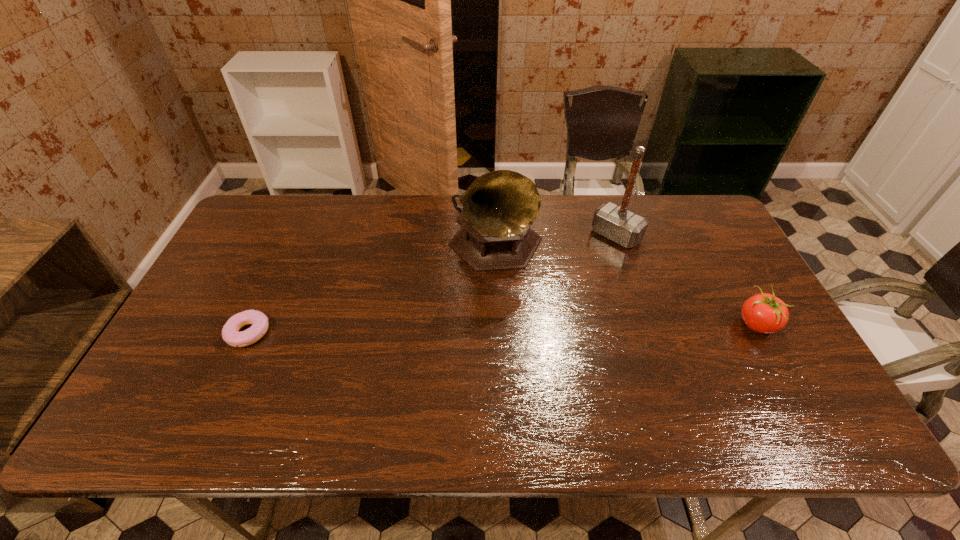
This screenshot has width=960, height=540. In the image, there is a desktop. What are the coordinates of `vacant space at the left edge` in the screenshot? It's located at (235, 253).

The image size is (960, 540). In the image, there is a desktop. Identify the location of free space at the right edge. (697, 262).

In the image, there is a desktop. At what (x,y) coordinates should I click in order to perform the action: click on free space at the far left corner. Please return your answer as a coordinate pair (x, y). The image size is (960, 540). Looking at the image, I should click on (262, 229).

Locate an element on the screen. free spot at the near right corner of the desktop is located at coordinates (768, 381).

Identify the location of vacant area that lies between the tomato and the shortest object. The height and width of the screenshot is (540, 960). (502, 329).

Where is `vacant space that is in between the hammer and the phonograph record`? The height and width of the screenshot is (540, 960). vacant space that is in between the hammer and the phonograph record is located at coordinates (556, 243).

Find the location of a particular element. free point between the phonograph record and the second shortest object is located at coordinates (626, 288).

Find the location of `free space that is in between the tomato and the hammer`. free space that is in between the tomato and the hammer is located at coordinates (686, 280).

Identify the location of vacant area that lies between the third tallest object and the second object from right to left. This screenshot has width=960, height=540. (686, 280).

At what (x,y) coordinates should I click in order to perform the action: click on free spot between the third object from left to right and the phonograph record. Please return your answer as a coordinate pair (x, y). Looking at the image, I should click on (556, 243).